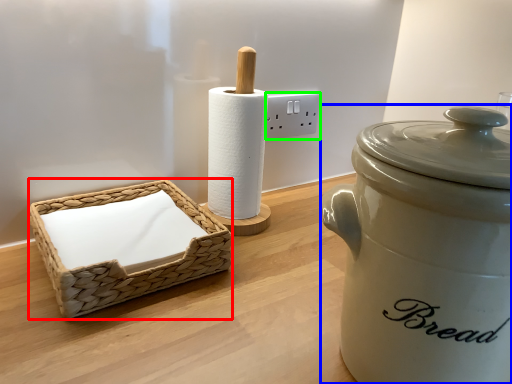
Question: Estimate the real-world distances between objects in this image. Which object is farther from basket (highlighted by a red box), rice cooker (highlighted by a blue box) or electric outlet (highlighted by a green box)?

Choices:
 (A) rice cooker
 (B) electric outlet

Answer: (B)